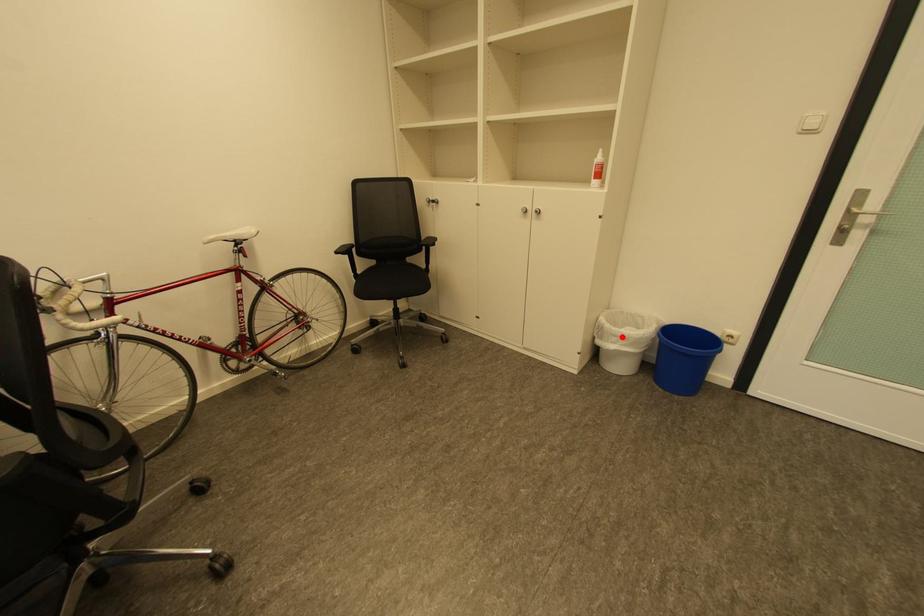
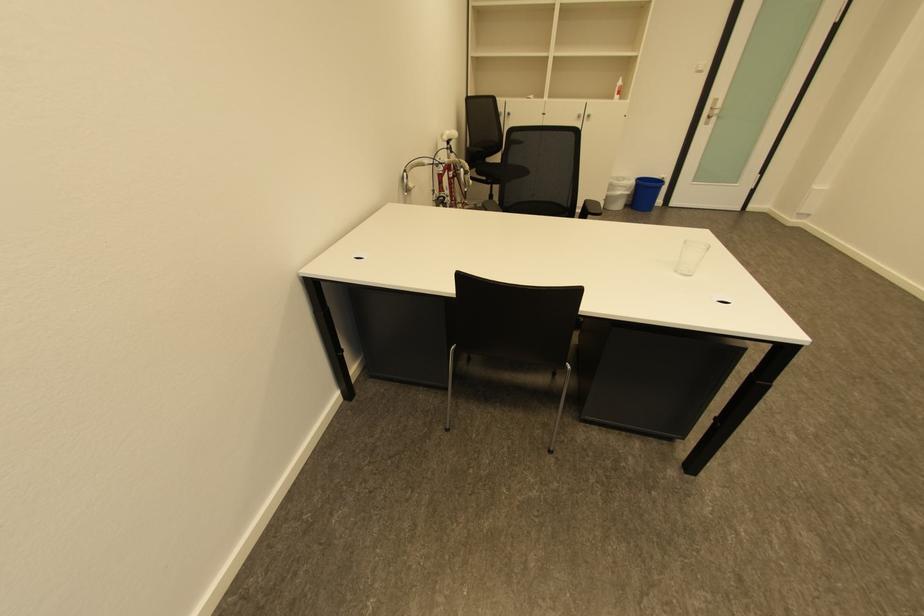
The point at the highlighted location is marked in the first image. Where is the corresponding point in the second image?

(626, 188)